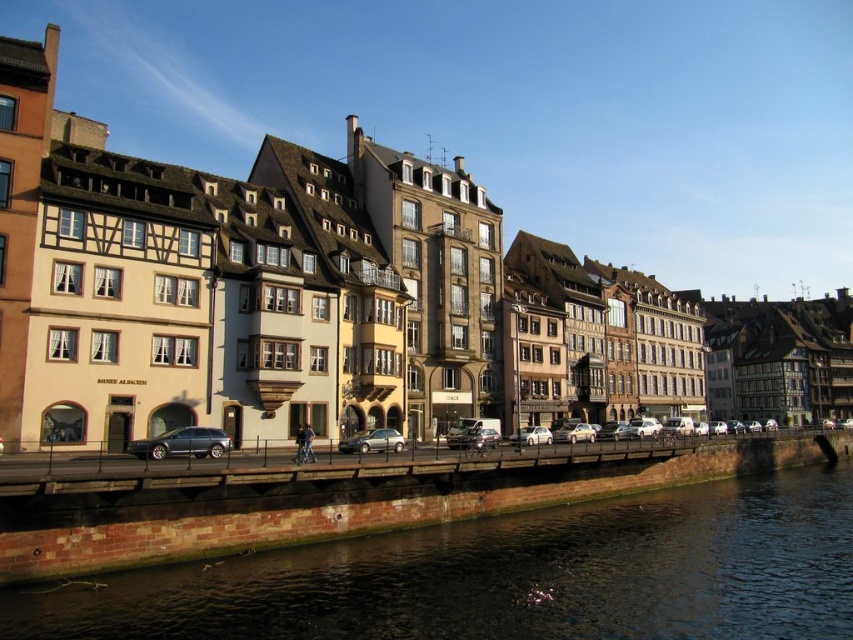
Question: Does dark brown stone river at lower center have a larger size compared to metallic silver car at center?

Choices:
 (A) no
 (B) yes

Answer: (B)

Question: Which of the following is the closest to the observer?

Choices:
 (A) (376, 435)
 (B) (219, 445)
 (C) (699, 502)
 (D) (517, 436)

Answer: (B)

Question: Which of these objects is positioned farthest from the white matte car at center?

Choices:
 (A) silver metallic car at center
 (B) metallic gray station wagon at center
 (C) dark brown stone river at lower center

Answer: (B)

Question: Is dark brown stone river at lower center smaller than metallic gray station wagon at center?

Choices:
 (A) no
 (B) yes

Answer: (A)

Question: Does dark brown stone river at lower center lie behind metallic gray station wagon at center?

Choices:
 (A) yes
 (B) no

Answer: (B)

Question: Among these objects, which one is nearest to the camera?

Choices:
 (A) white matte car at center
 (B) metallic silver car at center
 (C) dark brown stone river at lower center
 (D) silver metallic car at center

Answer: (C)